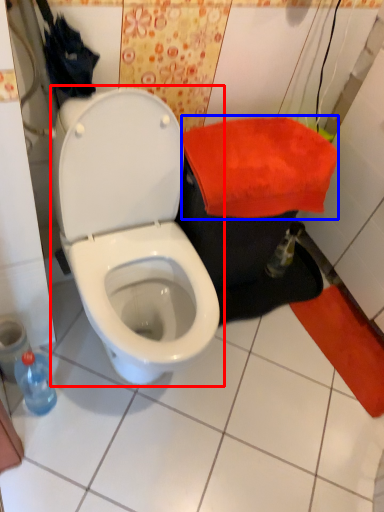
Question: Which object is closer to the camera taking this photo, toilet (highlighted by a red box) or beach towel (highlighted by a blue box)?

Choices:
 (A) toilet
 (B) beach towel

Answer: (A)